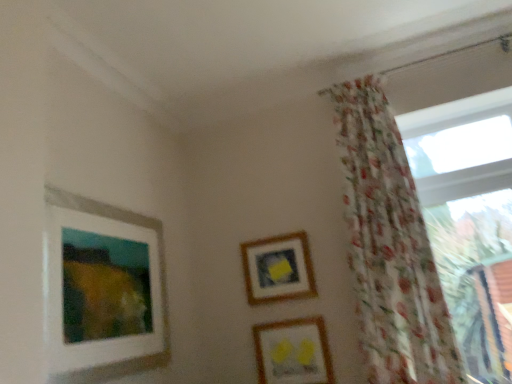
Question: Visually, is transparent glass window at right positioned to the left or to the right of floral sheer curtain at right?

Choices:
 (A) left
 (B) right

Answer: (B)

Question: In the image, is transparent glass window at right positioned in front of or behind floral sheer curtain at right?

Choices:
 (A) behind
 (B) front

Answer: (A)

Question: Which of these objects is positioned closest to the matte yellow birds at lower center, arranged as the third picture frame when viewed from the left?

Choices:
 (A) white matte picture frame at upper left, which is the 3th picture frame from right to left
 (B) transparent glass window at right
 (C) wooden frame at center, marked as the 2th picture frame in a left-to-right arrangement
 (D) floral sheer curtain at right

Answer: (C)

Question: Which object is the closest to the white matte picture frame at upper left, the first picture frame when ordered from left to right?

Choices:
 (A) wooden frame at center, positioned as the second picture frame in right-to-left order
 (B) transparent glass window at right
 (C) matte yellow birds at lower center, arranged as the third picture frame when viewed from the left
 (D) floral sheer curtain at right

Answer: (A)